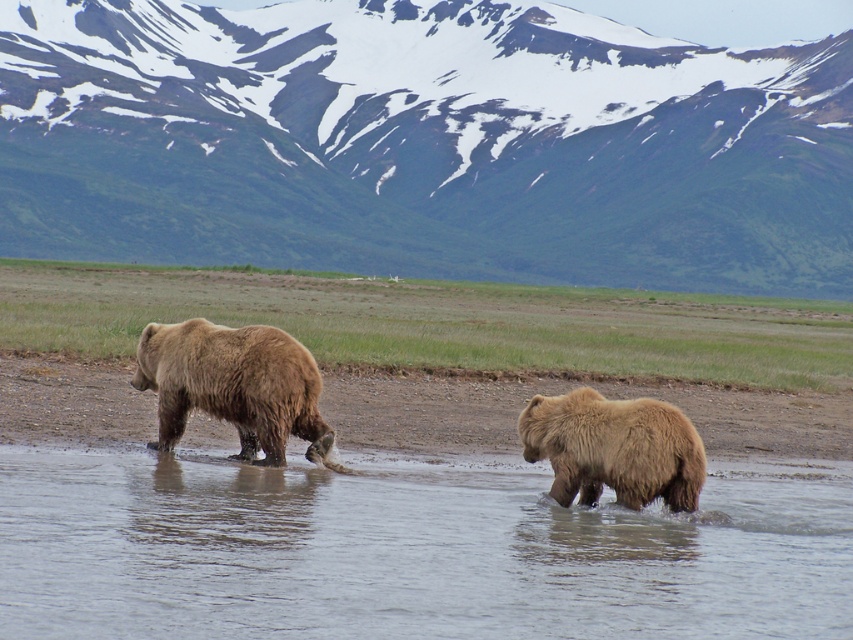
You are a photographer trying to capture a photo of the brown furry bear at right while ensuring the snowy rock mountain at upper center is visible in the background. Based on their sizes, which object should appear bigger in your photo?

The snowy rock mountain at upper center should appear bigger in the photo because it is larger in size than the brown furry bear at right.

You are a photographer standing at the shoreline where the bears are. You want to take a photo of the snowy rock mountain at upper center and the brown furry bear at right in the same frame. Considering the distance between them, will the mountain and the bear appear in the same photo if your camera has a standard 50mm lens?

The snowy rock mountain at upper center is 239.69 feet from the brown furry bear at right. With a standard 50mm lens, which has a field of view of about 46 degrees, the distance between them may be too great to capture both in the same frame unless you are positioned at a vantage point that allows the lens to encompass both subjects. However, without knowing the exact camera position and focal length adjustment, it is difficult to confirm definitively.